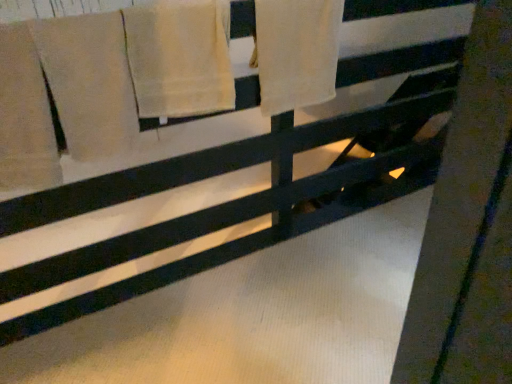
Describe the element at coordinates (297, 52) in the screenshot. I see `white cotton towel at upper center` at that location.

In order to face white cotton towel at upper center, should I rotate leftwards or rightwards?

It's best to rotate right around 5.982 degrees.

Locate an element on the screen. This screenshot has width=512, height=384. white cotton towel at upper center is located at coordinates (297, 52).

Identify the location of white cotton towel at upper center. (297, 52).